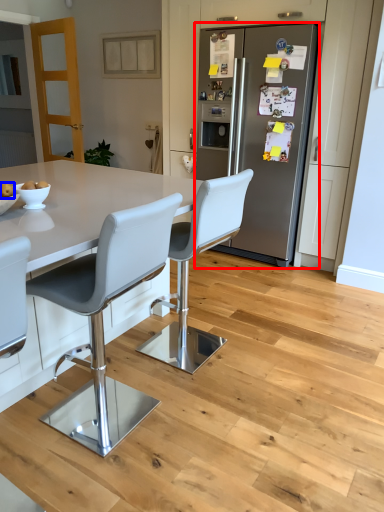
Question: Which of the following is the farthest to the observer, refrigerator (highlighted by a red box) or fruit (highlighted by a blue box)?

Choices:
 (A) refrigerator
 (B) fruit

Answer: (A)